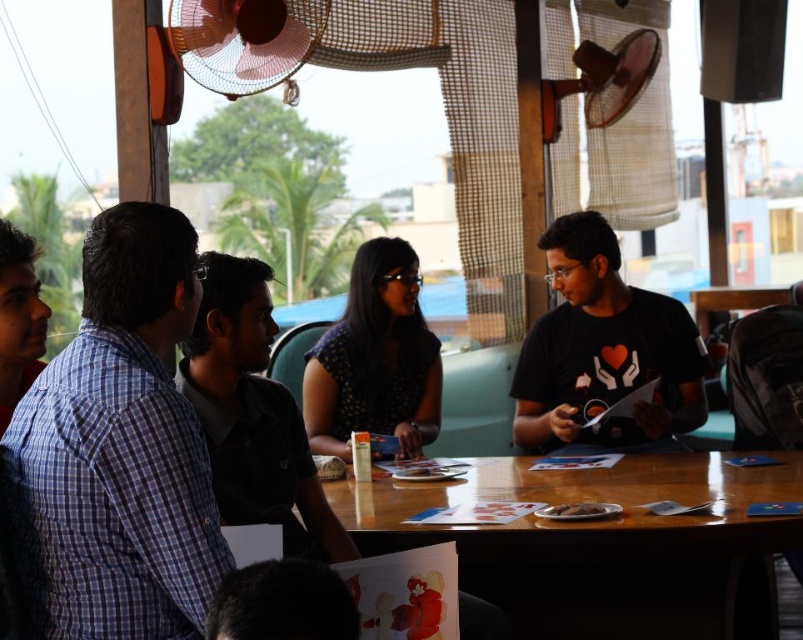
Question: Can you confirm if black matte shirt at center is positioned below dark blue dotted dress at center?

Choices:
 (A) yes
 (B) no

Answer: (A)

Question: Which of these objects is positioned closest to the black matte t-shirt at center?

Choices:
 (A) black matte shirt at center
 (B) matte blue shirt at left

Answer: (A)

Question: Does black matte shirt at center have a greater width compared to metallic fan at upper center?

Choices:
 (A) yes
 (B) no

Answer: (B)

Question: Among these points, which one is farthest from the camera?

Choices:
 (A) (15, 387)
 (B) (594, 490)

Answer: (B)

Question: Is metallic fan at upper center to the left of matte blue shirt at left from the viewer's perspective?

Choices:
 (A) yes
 (B) no

Answer: (B)

Question: Which is nearer to the black matte shirt at center?

Choices:
 (A) matte blue shirt at left
 (B) metallic silver fan at upper right

Answer: (A)